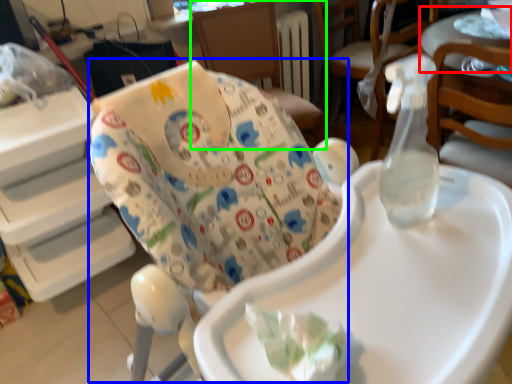
Question: Which object is positioned closest to table (highlighted by a red box)? Select from rocking chair (highlighted by a blue box) and chair (highlighted by a green box).

Choices:
 (A) rocking chair
 (B) chair

Answer: (B)